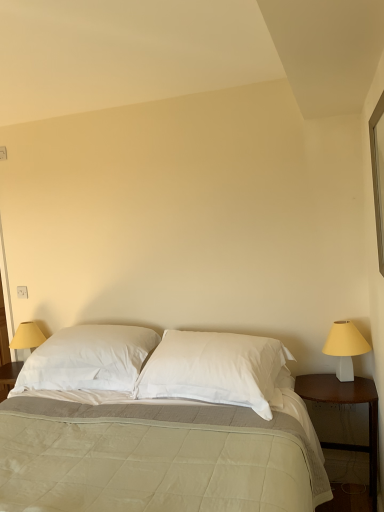
Question: Is the depth of white soft pillow at center, which appears as the 1th pillow when viewed from the right, greater than that of white matte lampshade at right?

Choices:
 (A) yes
 (B) no

Answer: (B)

Question: From a real-world perspective, is white soft pillow at center, which is the second pillow in left-to-right order, physically above white matte lampshade at right?

Choices:
 (A) yes
 (B) no

Answer: (B)

Question: Is white soft pillow at center, which appears as the 1th pillow when viewed from the right, wider than white matte lampshade at right?

Choices:
 (A) no
 (B) yes

Answer: (B)

Question: Would you say white matte lampshade at right is part of white soft pillow at center, which appears as the 1th pillow when viewed from the right,'s contents?

Choices:
 (A) yes
 (B) no

Answer: (B)

Question: Is white soft pillow at center, which is the second pillow in left-to-right order, smaller than white matte lampshade at right?

Choices:
 (A) yes
 (B) no

Answer: (B)

Question: Considering the relative sizes of white soft pillow at center, which appears as the 1th pillow when viewed from the right, and white matte lampshade at right in the image provided, is white soft pillow at center, which appears as the 1th pillow when viewed from the right, bigger than white matte lampshade at right?

Choices:
 (A) yes
 (B) no

Answer: (A)

Question: Is white matte lampshade at right with wooden nightstand at right?

Choices:
 (A) yes
 (B) no

Answer: (B)

Question: Considering the relative positions of white matte lampshade at right and wooden nightstand at right in the image provided, is white matte lampshade at right in front of wooden nightstand at right?

Choices:
 (A) yes
 (B) no

Answer: (B)

Question: Is white matte lampshade at right smaller than wooden nightstand at right?

Choices:
 (A) no
 (B) yes

Answer: (B)

Question: Can you confirm if white matte lampshade at right is thinner than wooden nightstand at right?

Choices:
 (A) no
 (B) yes

Answer: (B)

Question: Is white matte lampshade at right not within wooden nightstand at right?

Choices:
 (A) yes
 (B) no

Answer: (A)

Question: Could you tell me if white matte lampshade at right is turned towards wooden nightstand at right?

Choices:
 (A) yes
 (B) no

Answer: (B)

Question: Considering the relative sizes of clear glass window at upper right and white matte lampshade at right in the image provided, is clear glass window at upper right bigger than white matte lampshade at right?

Choices:
 (A) yes
 (B) no

Answer: (B)